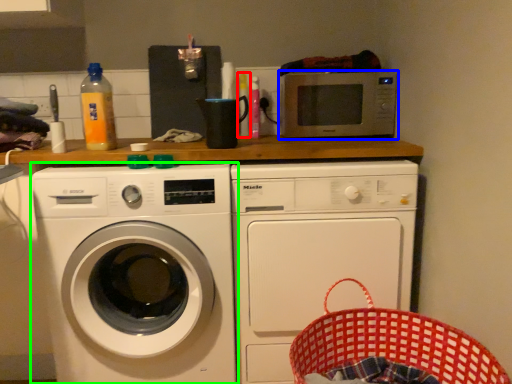
Question: Estimate the real-world distances between objects in this image. Which object is closer to bottle (highlighted by a red box), microwave oven (highlighted by a blue box) or washing machine (highlighted by a green box)?

Choices:
 (A) microwave oven
 (B) washing machine

Answer: (A)